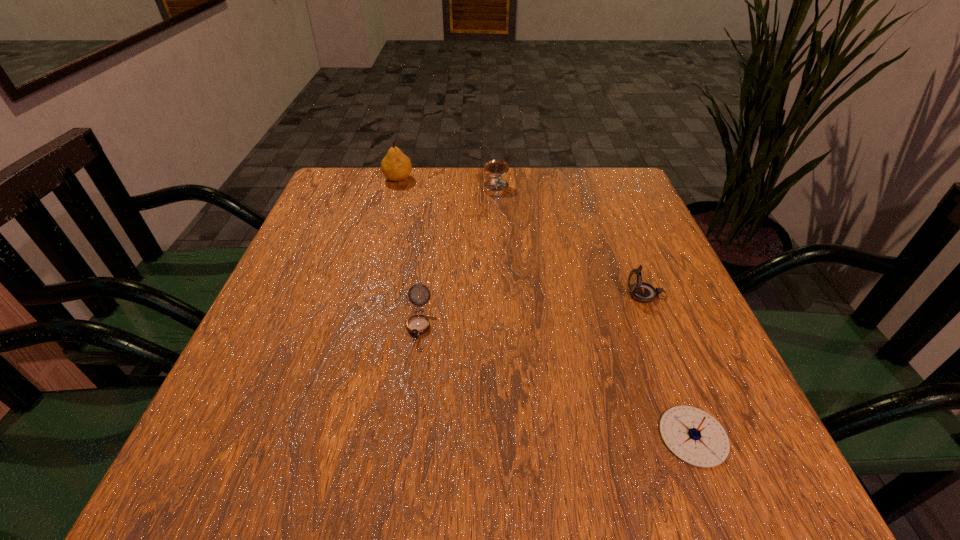
Find the location of a particular element. pear is located at coordinates (396, 166).

In order to click on the tallest object in this screenshot , I will do `click(396, 166)`.

Locate an element on the screen. the third compass from right to left is located at coordinates (496, 187).

Find the location of a particular element. This screenshot has width=960, height=540. the farthest compass is located at coordinates (496, 187).

Identify the location of the leftmost compass. (418, 324).

Locate an element on the screen. The image size is (960, 540). the nearest compass is located at coordinates click(x=694, y=436).

Identify the location of free space located on the left of the leftmost object. (361, 179).

What are the coordinates of `free region located with the dial facing the third compass from right to left` in the screenshot? It's located at (497, 212).

Find the location of a particular element. This screenshot has height=540, width=960. free space located 0.210m on the face of the leftmost compass is located at coordinates (400, 460).

Identify the location of vacant region located 0.390m on the back of the nearest object. The image size is (960, 540). (623, 252).